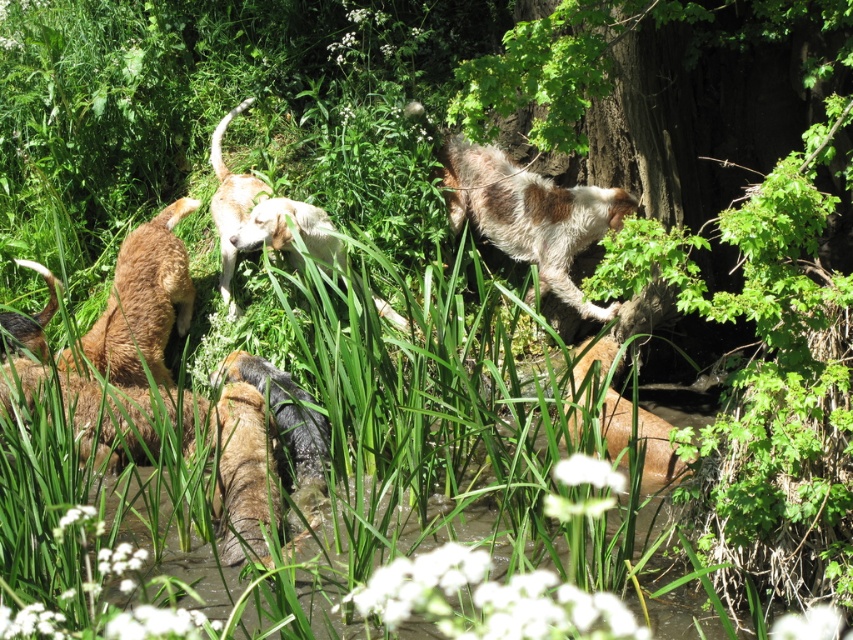
You are a photographer standing at the edge of the water body. You want to take a photo that includes both the brown furry dog at lower right and the white fur dog at center. Which dog should you focus on first to ensure both are in the frame?

You should focus on the brown furry dog at lower right first because it is closer to the viewer than the white fur dog at center. By focusing on the closer dog, you can ensure the depth of field captures both subjects in the frame.

You are a photographer trying to capture a photo of the two dogs. You want to ensure both the brown fur dog at center and the brown furry dog at lower right are visible in the frame. Based on their positions, which dog is located to the left of the other?

The brown fur dog at center is positioned on the left side of brown furry dog at lower right, so the brown fur dog at center is to the left of the brown furry dog at lower right.

Looking at this image, you are a photographer standing at the camera position. You want to take a closeup shot of the brown furry dog at lower right. Considering the distance, can you capture the dog clearly without moving closer?

The brown furry dog at lower right is 4.53 meters away from camera. To capture a clear closeup shot, you would need a zoom lens with sufficient reach to focus on the dog from that distance without moving closer.